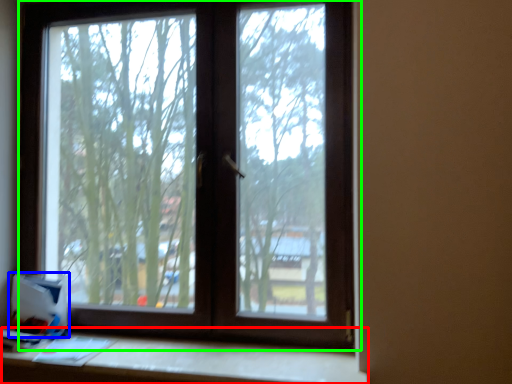
Question: Which object is positioned farthest from table (highlighted by a red box)? Select from cardboard box (highlighted by a blue box) and window (highlighted by a green box).

Choices:
 (A) cardboard box
 (B) window

Answer: (B)